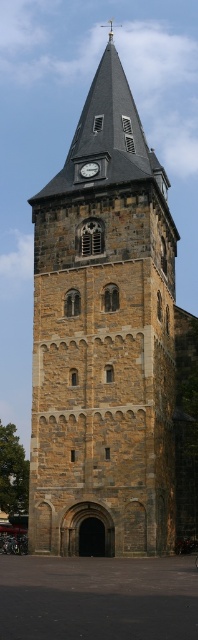
Can you confirm if brown stone church at center is thinner than white clock face at upper center?

No.

Which of these two, brown stone church at center or white clock face at upper center, stands shorter?

white clock face at upper center

The height and width of the screenshot is (640, 198). I want to click on brown stone church at center, so click(x=110, y=346).